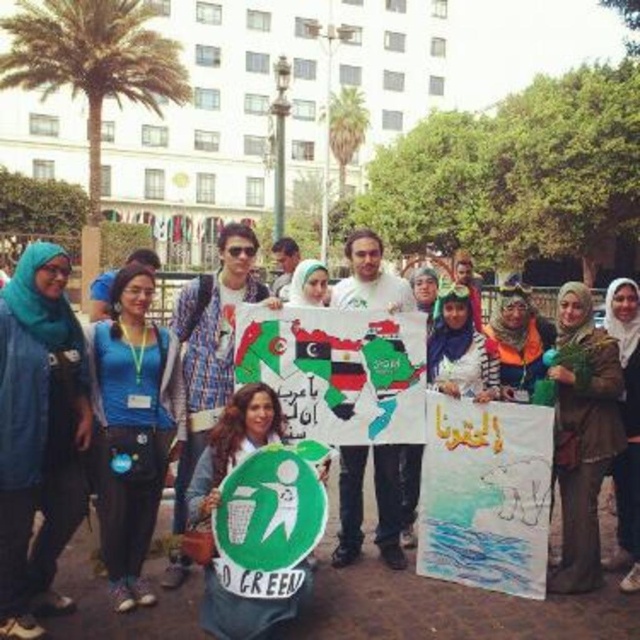
Who is taller, blue fabric shirt at left or brown leather jacket at center?

Standing taller between the two is blue fabric shirt at left.

Between blue fabric shirt at left and brown leather jacket at center, which one is positioned lower?

Positioned lower is brown leather jacket at center.

What do you see at coordinates (132, 428) in the screenshot?
I see `blue fabric shirt at left` at bounding box center [132, 428].

The image size is (640, 640). I want to click on blue fabric shirt at left, so click(132, 428).

Who is lower down, teal fabric hijab at center or white paper poster at center?

Positioned lower is white paper poster at center.

Which is behind, point (16, 520) or point (504, 442)?

The point (504, 442) is more distant.

Does point (17, 480) come farther from viewer compared to point (493, 474)?

No, it is in front of (493, 474).

The width and height of the screenshot is (640, 640). In order to click on teal fabric hijab at center in this screenshot , I will do `click(38, 435)`.

Does white paper poster at center have a greater height compared to brown leather jacket at center?

No, white paper poster at center is not taller than brown leather jacket at center.

Can you confirm if white paper poster at center is positioned above brown leather jacket at center?

Indeed, white paper poster at center is positioned over brown leather jacket at center.

Identify the location of white paper poster at center. The height and width of the screenshot is (640, 640). (484, 493).